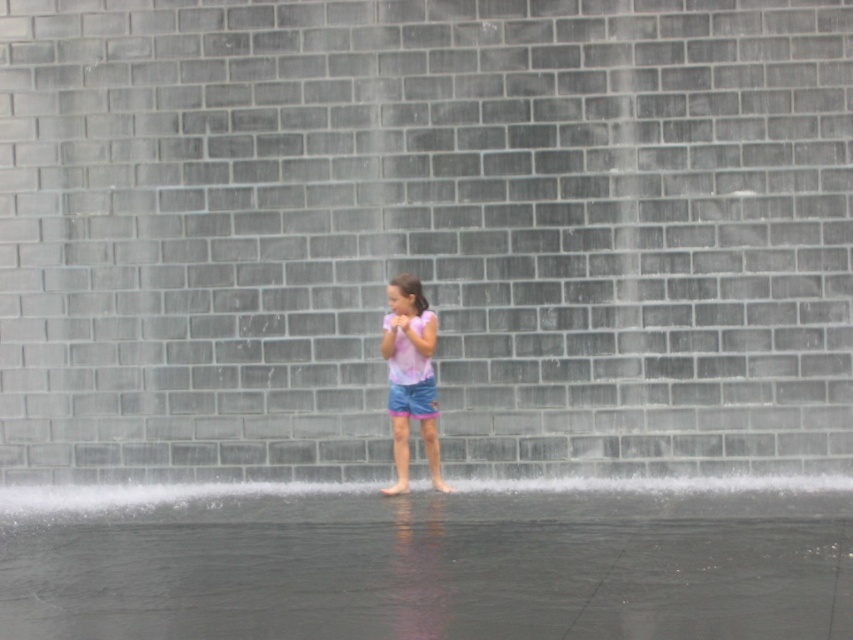
Between pink cotton shirt at center and blue denim shorts at center, which one appears on the left side from the viewer's perspective?

From the viewer's perspective, pink cotton shirt at center appears more on the left side.

I want to click on pink cotton shirt at center, so click(x=410, y=376).

Who is taller, clear water at lower center or blue denim shorts at center?

blue denim shorts at center is taller.

Find the location of a particular element. This screenshot has width=853, height=640. clear water at lower center is located at coordinates (430, 560).

Between point (158, 493) and point (419, 408), which one is positioned behind?

Point (158, 493)

Where is `clear water at lower center`? clear water at lower center is located at coordinates (430, 560).

Locate an element on the screen. The height and width of the screenshot is (640, 853). clear water at lower center is located at coordinates (430, 560).

Between clear water at lower center and pink cotton shirt at center, which one is positioned lower?

clear water at lower center

What do you see at coordinates (430, 560) in the screenshot? I see `clear water at lower center` at bounding box center [430, 560].

The height and width of the screenshot is (640, 853). What are the coordinates of `clear water at lower center` in the screenshot? It's located at (430, 560).